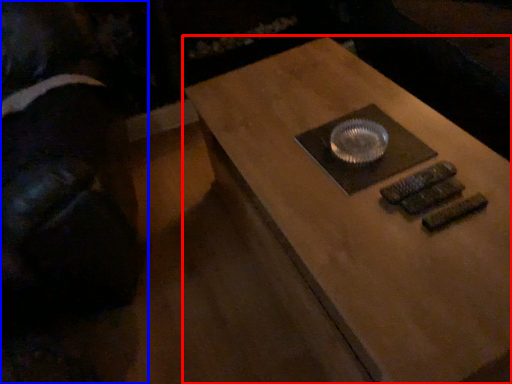
Question: Which point is further to the camera, table (highlighted by a red box) or person (highlighted by a blue box)?

Choices:
 (A) table
 (B) person

Answer: (B)